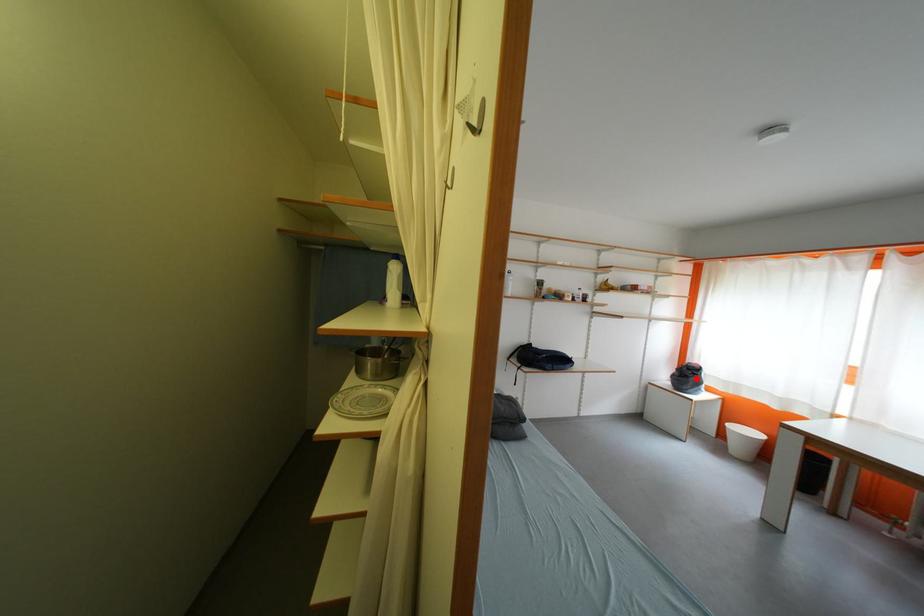
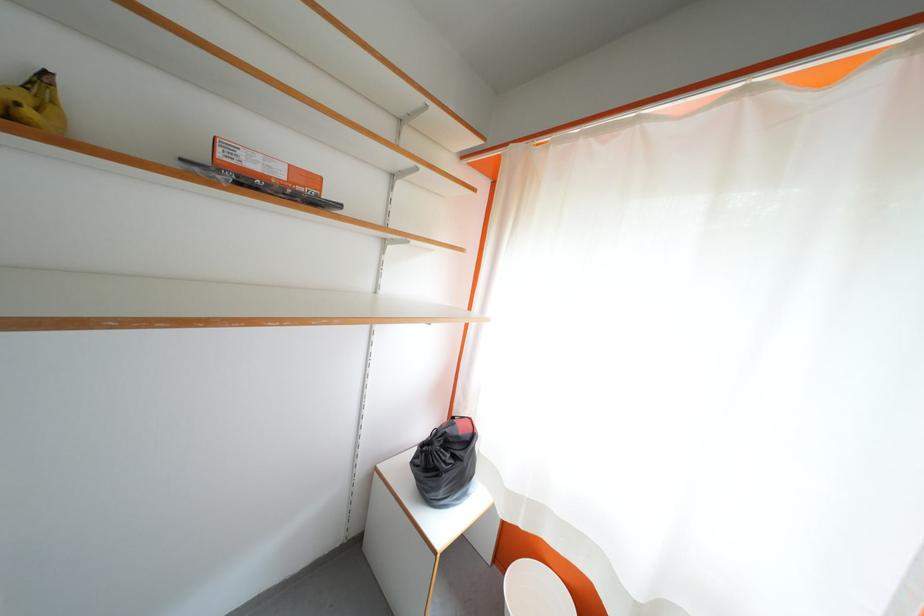
Find the pixel in the second image that matches the highlighted location in the first image.

(455, 460)